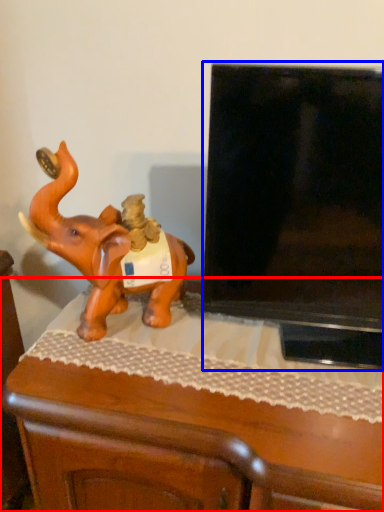
Question: Among these objects, which one is farthest to the camera, furniture (highlighted by a red box) or television (highlighted by a blue box)?

Choices:
 (A) furniture
 (B) television

Answer: (A)